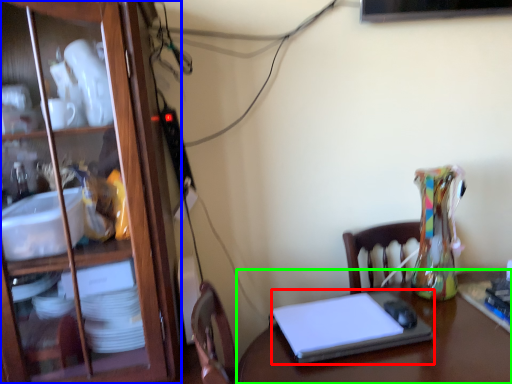
Question: Based on their relative distances, which object is nearer to laptop (highlighted by a red box)? Choose from cabinetry (highlighted by a blue box) and desk (highlighted by a green box).

Choices:
 (A) cabinetry
 (B) desk

Answer: (B)